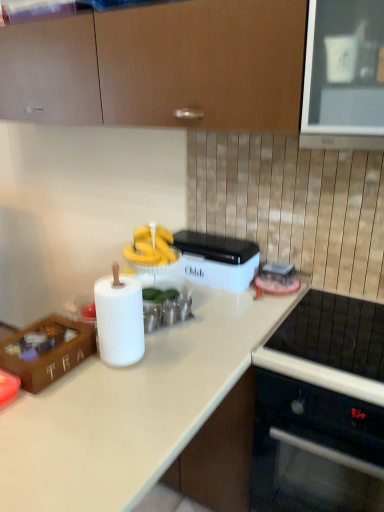
Question: Is matte wood cabinets at upper center further to camera compared to white plastic container at center?

Choices:
 (A) no
 (B) yes

Answer: (A)

Question: Is matte wood cabinets at upper center completely or partially outside of white plastic container at center?

Choices:
 (A) yes
 (B) no

Answer: (A)

Question: Does matte wood cabinets at upper center have a lesser width compared to white plastic container at center?

Choices:
 (A) yes
 (B) no

Answer: (B)

Question: Considering the relative sizes of matte wood cabinets at upper center and white plastic container at center in the image provided, is matte wood cabinets at upper center shorter than white plastic container at center?

Choices:
 (A) no
 (B) yes

Answer: (A)

Question: Is matte wood cabinets at upper center closer to camera compared to white plastic container at center?

Choices:
 (A) yes
 (B) no

Answer: (A)

Question: Is point (16, 72) closer or farther from the camera than point (29, 379)?

Choices:
 (A) farther
 (B) closer

Answer: (A)

Question: From their relative heights in the image, would you say matte wood cabinets at upper center is taller or shorter than wooden tea box at lower left?

Choices:
 (A) short
 (B) tall

Answer: (B)

Question: Is matte wood cabinets at upper center inside the boundaries of wooden tea box at lower left, or outside?

Choices:
 (A) inside
 (B) outside

Answer: (B)

Question: Looking at the image, does matte wood cabinets at upper center seem bigger or smaller compared to wooden tea box at lower left?

Choices:
 (A) big
 (B) small

Answer: (A)

Question: In the image, is black glass cooktop at lower right positioned in front of or behind white plastic container at center?

Choices:
 (A) behind
 (B) front

Answer: (B)

Question: Does point (299, 412) appear closer or farther from the camera than point (182, 249)?

Choices:
 (A) closer
 (B) farther

Answer: (A)

Question: From the image's perspective, is black glass cooktop at lower right positioned above or below white plastic container at center?

Choices:
 (A) below
 (B) above

Answer: (A)

Question: From a real-world perspective, is black glass cooktop at lower right physically located above or below white plastic container at center?

Choices:
 (A) above
 (B) below

Answer: (B)

Question: Is wooden tea box at lower left situated inside white matte countertop at center or outside?

Choices:
 (A) outside
 (B) inside

Answer: (A)

Question: Considering the positions of wooden tea box at lower left and white matte countertop at center in the image, is wooden tea box at lower left taller or shorter than white matte countertop at center?

Choices:
 (A) tall
 (B) short

Answer: (B)